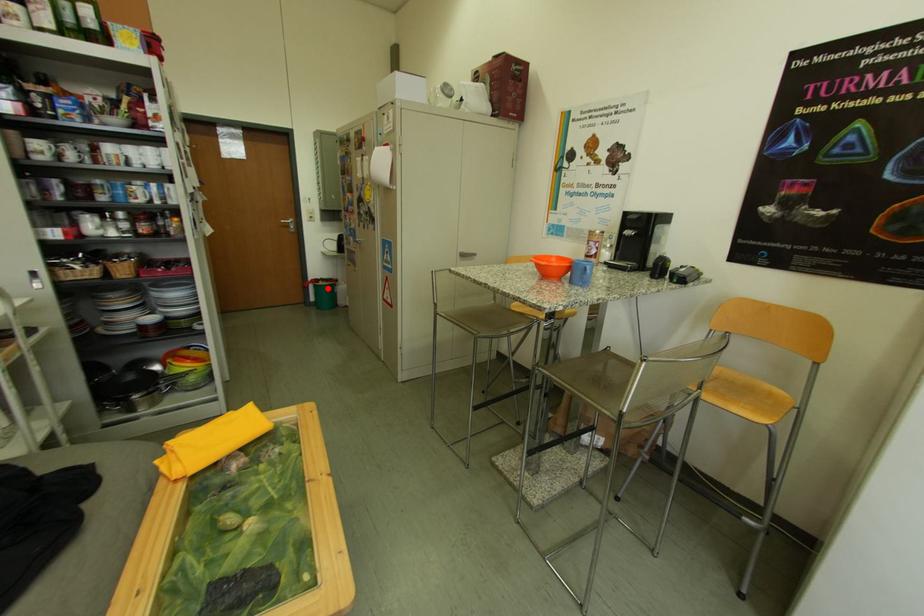
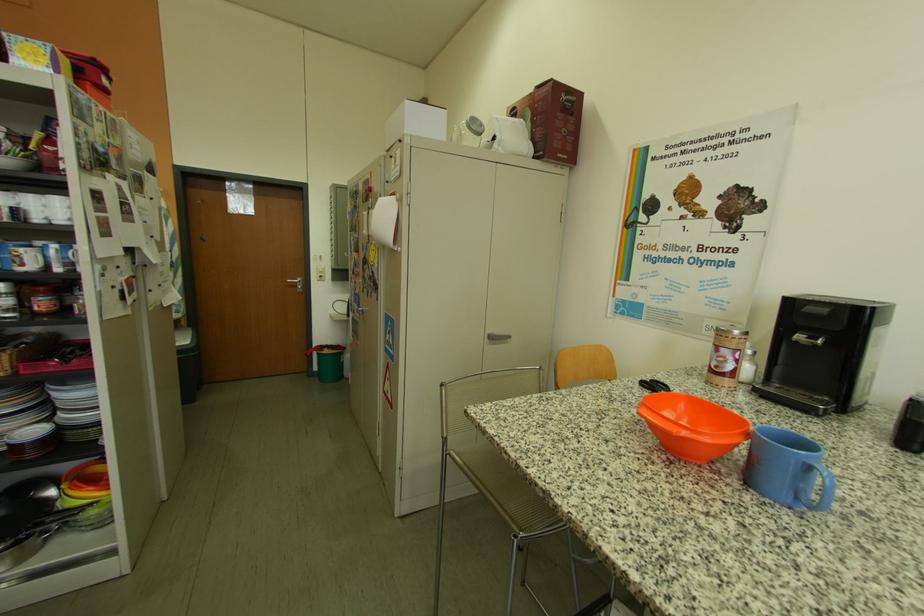
The point at the highlighted location is marked in the first image. Where is the corresponding point in the second image?

(331, 357)